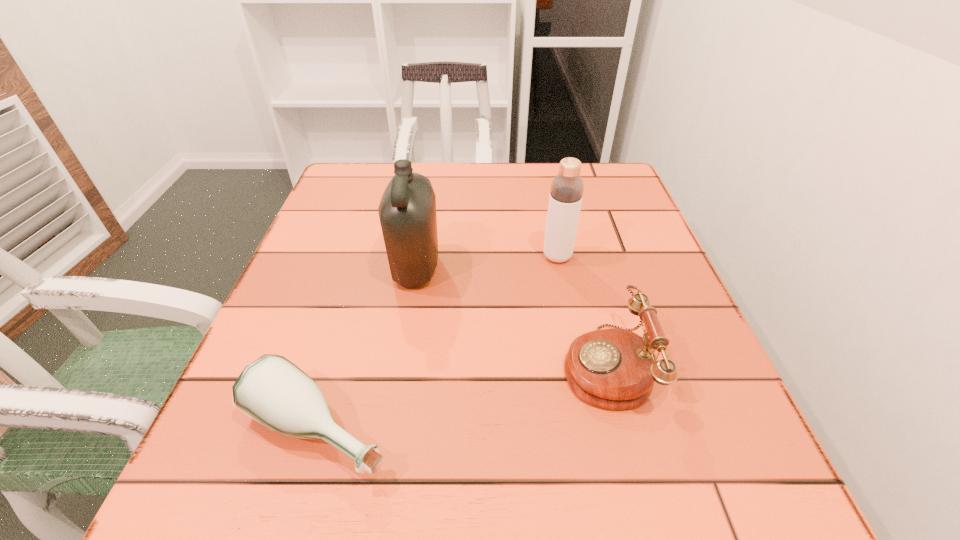
Image resolution: width=960 pixels, height=540 pixels. Identify the location of object located in the left edge section of the desktop. tap(272, 390).

Where is `object present at the right edge`? The image size is (960, 540). object present at the right edge is located at coordinates (615, 369).

Find the location of a particular element. object that is at the near left corner is located at coordinates (272, 390).

This screenshot has height=540, width=960. In the image, there is a desktop. Find the location of `free space at the far edge`. free space at the far edge is located at coordinates (471, 168).

Where is `free space at the near edge`? This screenshot has height=540, width=960. free space at the near edge is located at coordinates (564, 463).

Locate an element on the screen. blank space at the left edge of the desktop is located at coordinates (352, 231).

The height and width of the screenshot is (540, 960). Identify the location of vacant space at the right edge of the desktop. (694, 317).

Image resolution: width=960 pixels, height=540 pixels. In the image, there is a desktop. Identify the location of vacant space at the far left corner. (328, 193).

In the image, there is a desktop. Find the location of `vacant space at the far right corner`. vacant space at the far right corner is located at coordinates (611, 193).

Where is `vacant area at the near right corner of the desktop`? Image resolution: width=960 pixels, height=540 pixels. vacant area at the near right corner of the desktop is located at coordinates (758, 491).